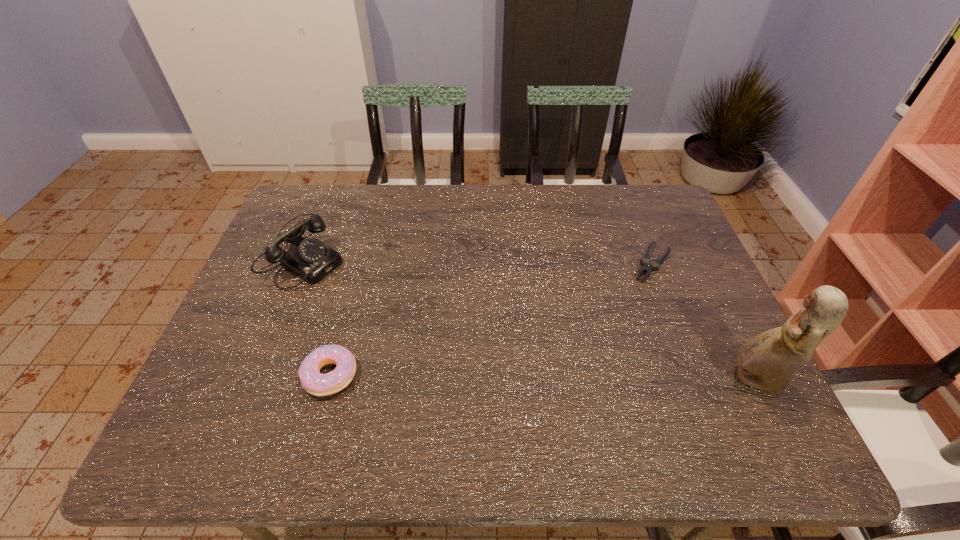
I want to click on the third tallest object, so click(315, 383).

Image resolution: width=960 pixels, height=540 pixels. I want to click on the rightmost object, so click(768, 361).

You are a GUI agent. You are given a task and a screenshot of the screen. Output one action in this format:
    pyautogui.click(x=<x>, y=<y>)
    Task: Click on the tallest object
    This screenshot has height=540, width=960.
    Given the screenshot: What is the action you would take?
    pyautogui.click(x=768, y=361)

This screenshot has width=960, height=540. I want to click on pliers, so coord(655,265).

Where is `the shortest object`? The image size is (960, 540). the shortest object is located at coordinates (655, 265).

Image resolution: width=960 pixels, height=540 pixels. In order to click on the third shortest object in this screenshot , I will do `click(308, 258)`.

At what (x,y) coordinates should I click in order to perform the action: click on blank space located on the back of the doughnut. Please return your answer as a coordinate pair (x, y). Image resolution: width=960 pixels, height=540 pixels. Looking at the image, I should click on (349, 304).

Identify the location of blank space located 0.400m on the front-facing side of the rightmost object. The image size is (960, 540). (551, 381).

I want to click on free space located on the front-facing side of the rightmost object, so click(x=600, y=381).

The width and height of the screenshot is (960, 540). Find the location of `free space located 0.050m on the front-facing side of the rightmost object`. free space located 0.050m on the front-facing side of the rightmost object is located at coordinates (707, 381).